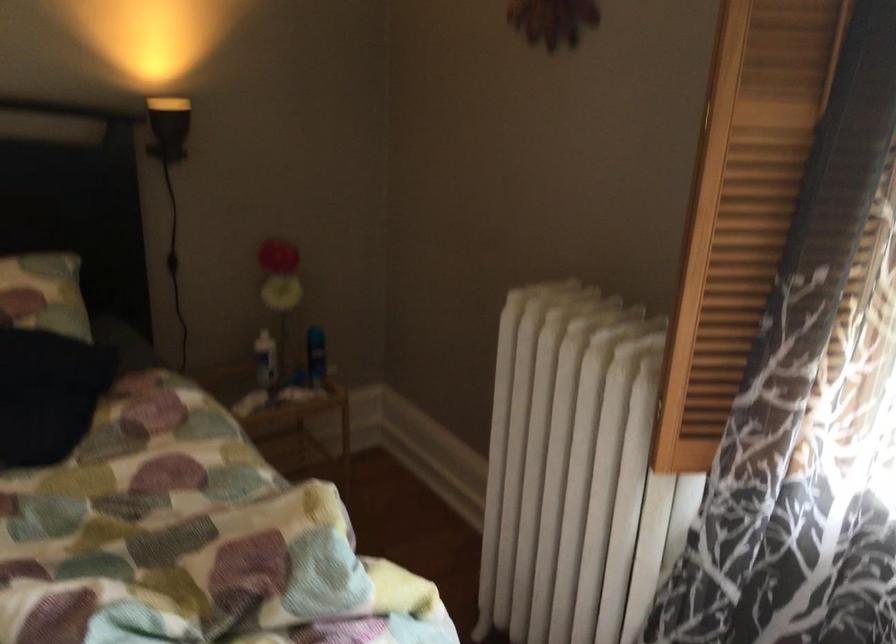
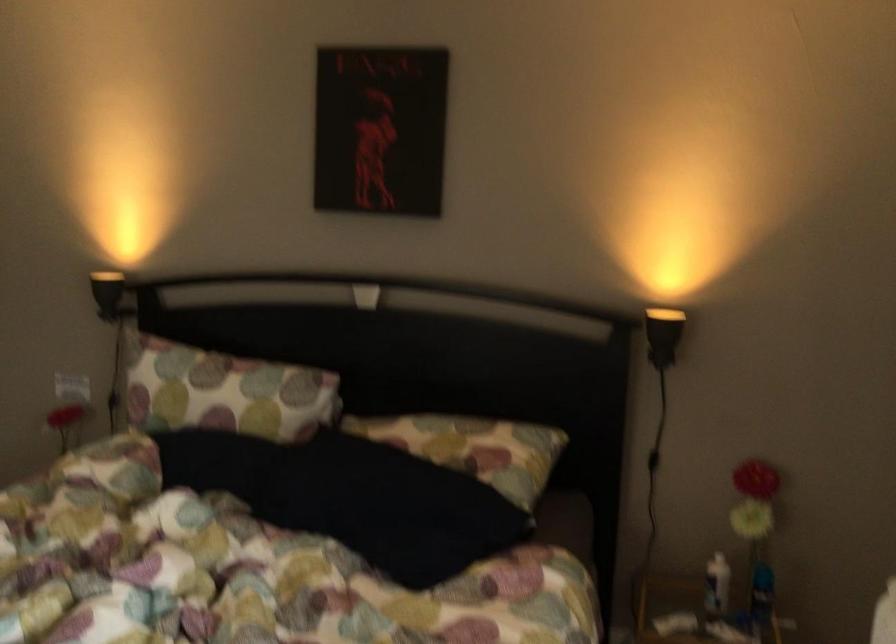
Question: How did the camera likely rotate?

Choices:
 (A) Left
 (B) Right
 (C) Up
 (D) Down

Answer: (A)